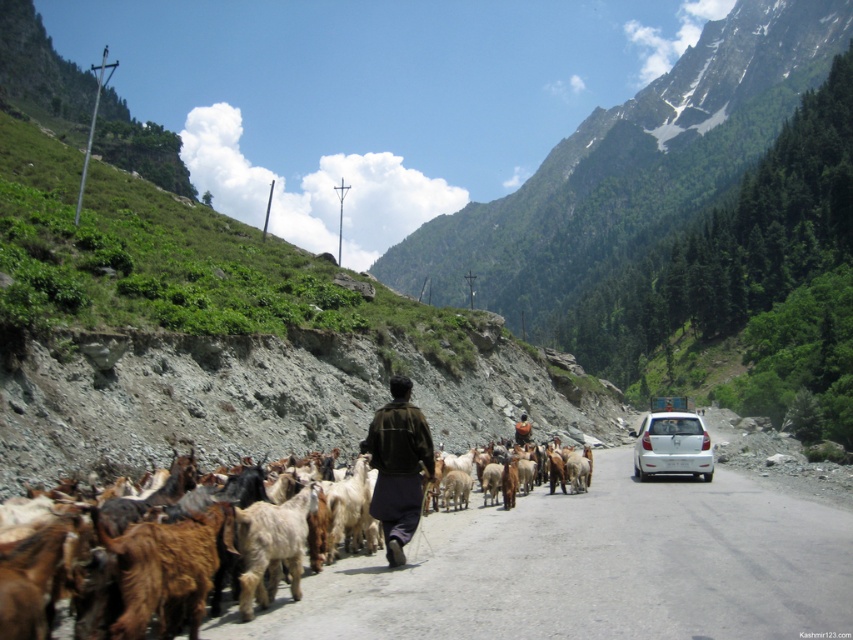
You are a photographer standing at the edge of the dirt road. You want to take a photo of the brown woolen goats at center and the brown woolen sweater at center. Which object should you zoom in on to capture more details of its texture?

The brown woolen goats at center has a greater height compared to brown woolen sweater at center, so you should zoom in on the brown woolen goats at center to capture more details of its texture.

You are a photographer trying to capture the shepherd and the car in the same frame. Given that the dark brown fabric at center is smaller than the white matte car at center, which object should you focus on first to ensure both are in the frame?

Since the dark brown fabric at center is smaller than the white matte car at center, you should focus on the white matte car at center first to ensure both objects are included in the frame.